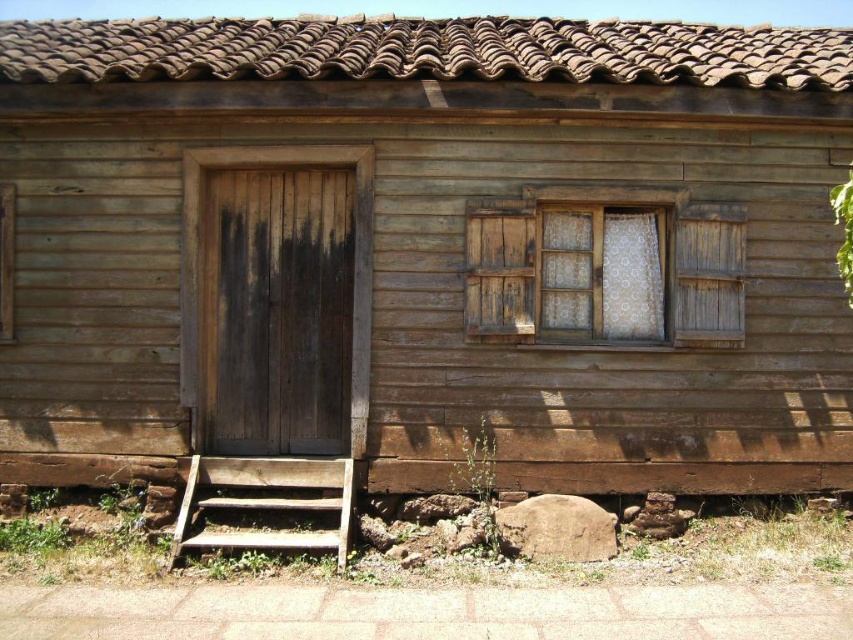
Does weathered wood window at center appear on the left side of weathered wood stairs at lower left?

No, weathered wood window at center is not to the left of weathered wood stairs at lower left.

Who is taller, weathered wood window at center or weathered wood stairs at lower left?

weathered wood window at center

Describe the element at coordinates (503, 262) in the screenshot. I see `weathered wood window at center` at that location.

I want to click on weathered wood window at center, so click(503, 262).